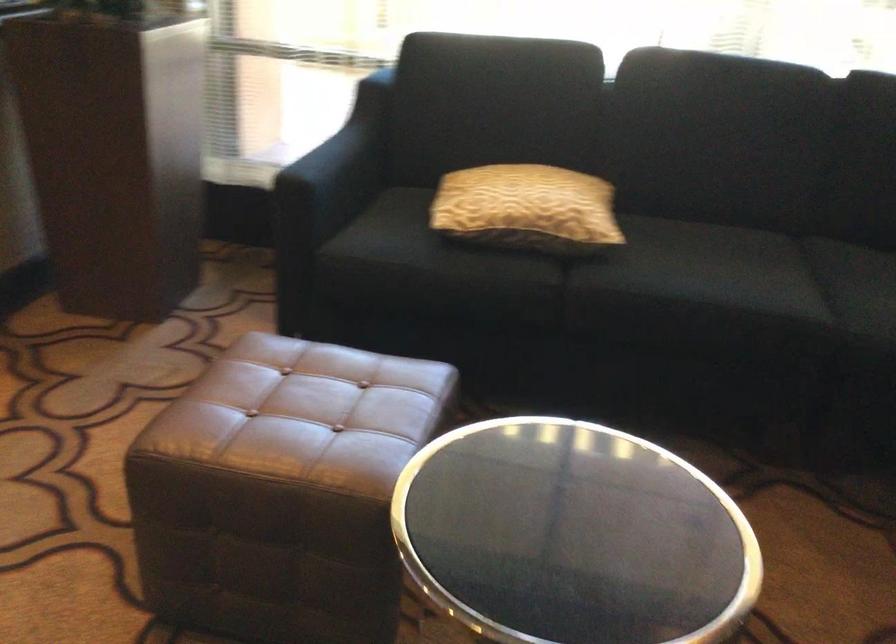
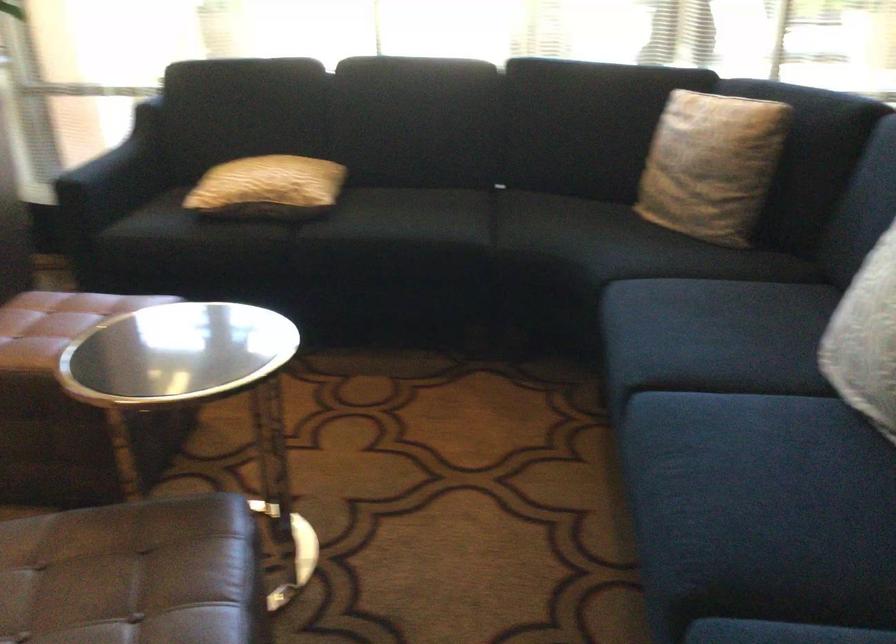
Where in the second image is the point corresponding to pixel 538 216 from the first image?

(268, 187)